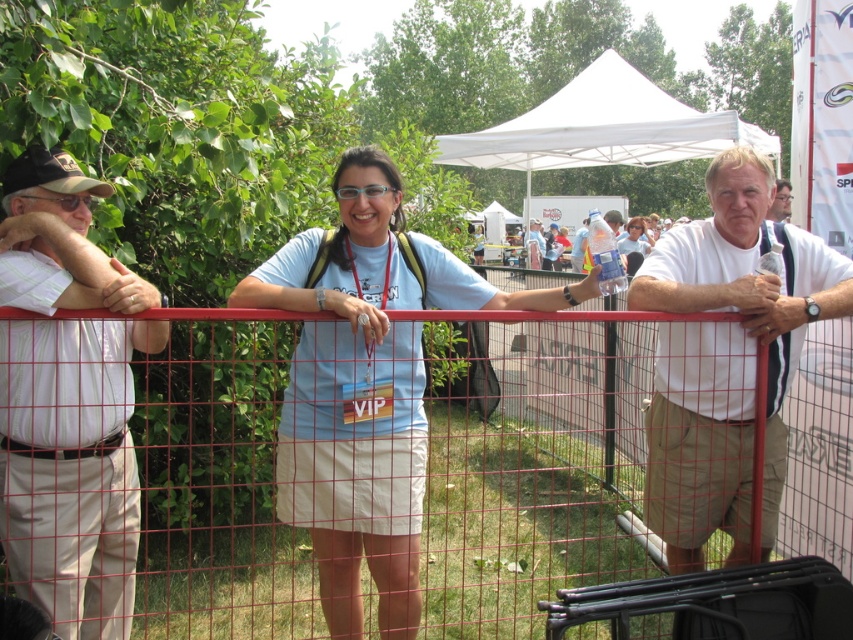
Does light blue t-shirt at center come behind white cotton shirt at left?

That is True.

Who is shorter, light blue t-shirt at center or white cotton shirt at left?

With less height is white cotton shirt at left.

Locate an element on the screen. The image size is (853, 640). light blue t-shirt at center is located at coordinates (366, 387).

Does point (726, 518) come in front of point (474, 161)?

Yes, it is.

Between point (735, 384) and point (701, 116), which one is positioned behind?

Positioned behind is point (701, 116).

You are a GUI agent. You are given a task and a screenshot of the screen. Output one action in this format:
    pyautogui.click(x=<x>, y=<y>)
    Task: Click on the white cotton shirt at right
    
    Given the screenshot: What is the action you would take?
    pyautogui.click(x=726, y=358)

Is light blue t-shirt at center bigger than white t-shirt at center?

Yes.

Does light blue t-shirt at center lie in front of white t-shirt at center?

That is True.

In order to click on light blue t-shirt at center in this screenshot , I will do `click(366, 387)`.